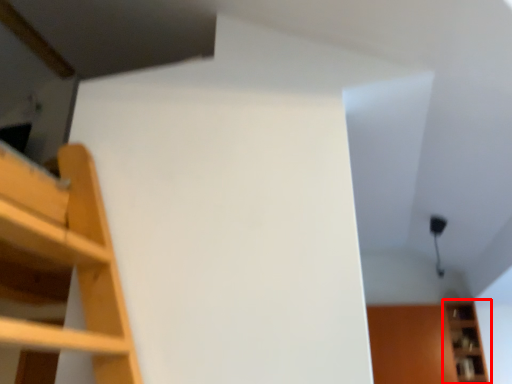
Question: In this image, where is shelf (annotated by the red box) located relative to cabinet?

Choices:
 (A) right
 (B) left

Answer: (A)